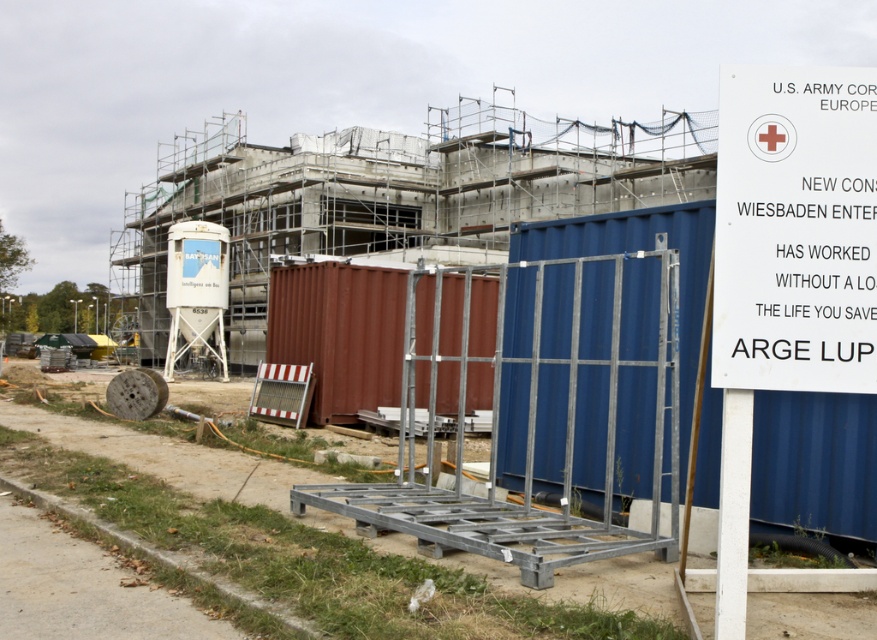
Question: Which point is farther from the camera taking this photo?

Choices:
 (A) (557, 316)
 (B) (426, 323)

Answer: (B)

Question: Can you confirm if blue metallic shipping container at right is positioned above white paper sign at upper right?

Choices:
 (A) yes
 (B) no

Answer: (B)

Question: Among these objects, which one is nearest to the camera?

Choices:
 (A) blue metallic shipping container at right
 (B) white paper sign at upper right
 (C) rusty metal shipping container at center

Answer: (B)

Question: Is blue metallic shipping container at right to the left of rusty metal shipping container at center from the viewer's perspective?

Choices:
 (A) yes
 (B) no

Answer: (B)

Question: Which object is the closest to the white paper sign at upper right?

Choices:
 (A) rusty metal shipping container at center
 (B) blue metallic shipping container at right

Answer: (B)

Question: Does blue metallic shipping container at right lie behind rusty metal shipping container at center?

Choices:
 (A) yes
 (B) no

Answer: (B)